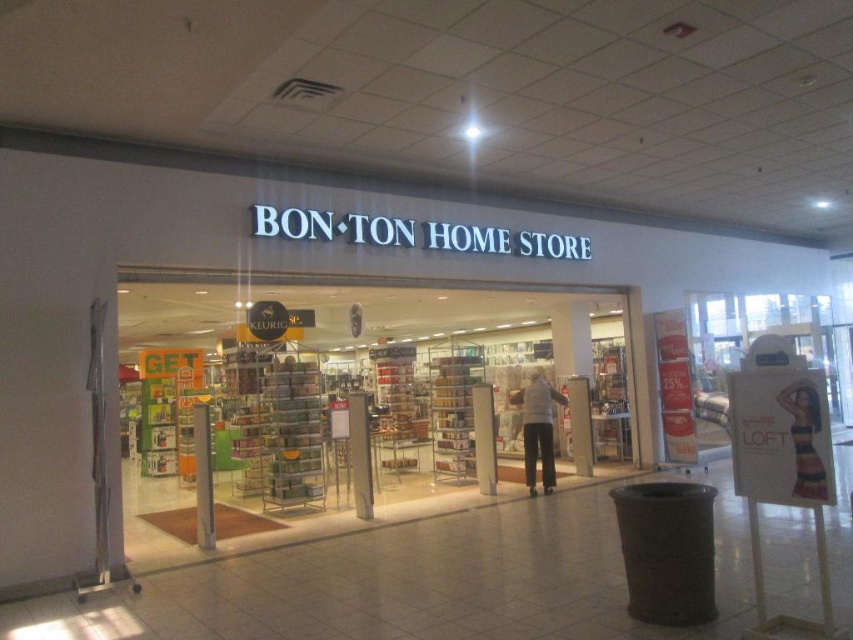
In the scene shown: Is clear plastic shelves at center shorter than gray wool sweater at center?

No, clear plastic shelves at center is not shorter than gray wool sweater at center.

Does clear plastic shelves at center appear under gray wool sweater at center?

Actually, clear plastic shelves at center is above gray wool sweater at center.

Locate an element on the screen. clear plastic shelves at center is located at coordinates (337, 388).